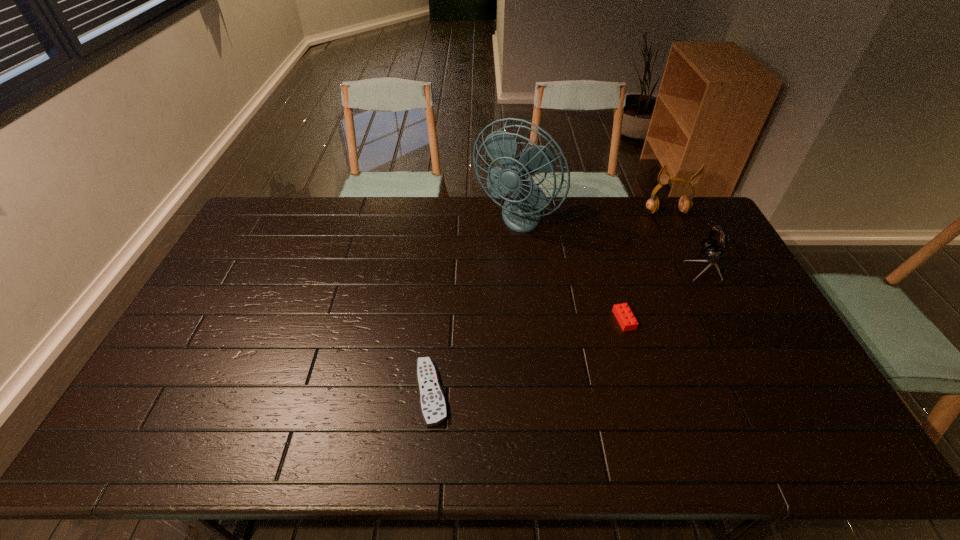
Find the location of a particular element. This screenshot has height=540, width=960. vacant space at the near edge of the desktop is located at coordinates (620, 433).

This screenshot has height=540, width=960. In the image, there is a desktop. In order to click on vacant space at the left edge in this screenshot , I will do `click(231, 319)`.

This screenshot has height=540, width=960. Identify the location of free space at the right edge of the desktop. (693, 273).

In the image, there is a desktop. Identify the location of free space at the far left corner. Image resolution: width=960 pixels, height=540 pixels. (256, 211).

The width and height of the screenshot is (960, 540). In the image, there is a desktop. In order to click on vacant space at the near left corner in this screenshot , I will do `click(137, 430)`.

Find the location of a particular element. Image resolution: width=960 pixels, height=540 pixels. vacant point at the far right corner is located at coordinates (669, 213).

What are the coordinates of `free point at the near right corner` in the screenshot? It's located at (778, 443).

Find the location of `free space between the fan and the nearer earphone`. free space between the fan and the nearer earphone is located at coordinates (610, 244).

Where is `vacant region between the nearer earphone and the farther earphone`? The width and height of the screenshot is (960, 540). vacant region between the nearer earphone and the farther earphone is located at coordinates (686, 240).

Find the location of a particular element. The image size is (960, 540). free area in between the shortest object and the third tallest object is located at coordinates (568, 330).